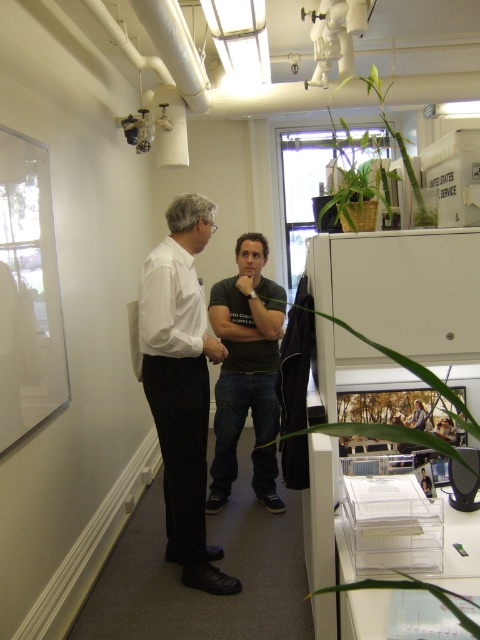
You are standing at the point marked as point (x=269, y=506) in the office. If you want to take a photo of the entire room, would you need to move closer or farther away from the point to ensure the entire office fits in the frame?

Since the point (x=269, y=506) is 3.28 meters away from the camera, you would need to move farther away from the point to ensure the entire office fits in the frame.

You are standing in the office scene described. There is a point marked at coordinates (243, 358). What object is located at that point?

The point at coordinates (243, 358) marks the dark green tshirt at center.